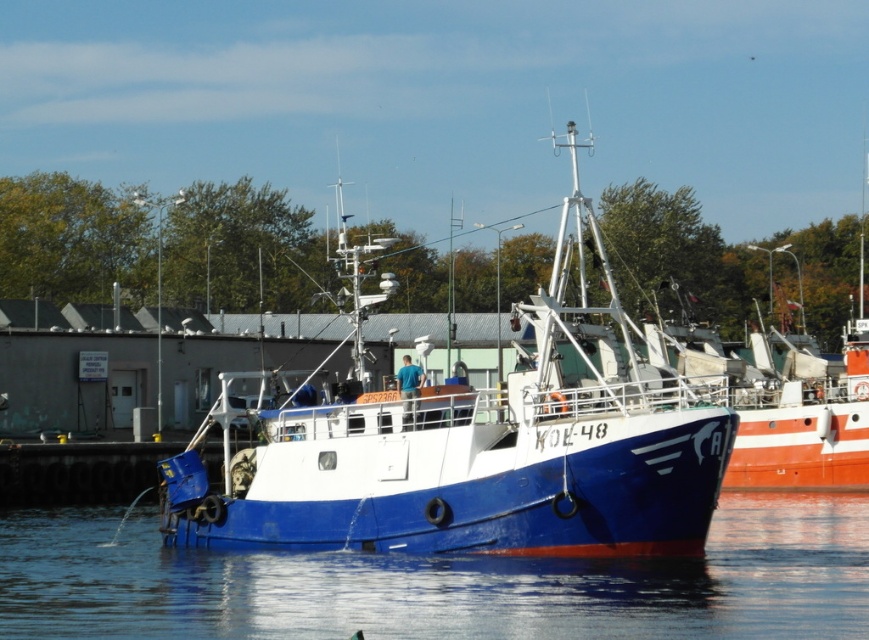
You are standing on the dock and want to board the blue matte boat at center. To do so, you need to walk along the dock towards the point marked by the coordinates. Are you facing the correct direction if you walk towards the point at coordinates (483, 451)?

Yes, walking towards the point at coordinates (483, 451) will lead you directly to the blue matte boat at center as that point marks its location.

You are standing on the dock and see the blue matte boat at center and the blue water at lower center. Which object is positioned to the right of the other?

The blue matte boat at center is to the right of the blue water at lower center.